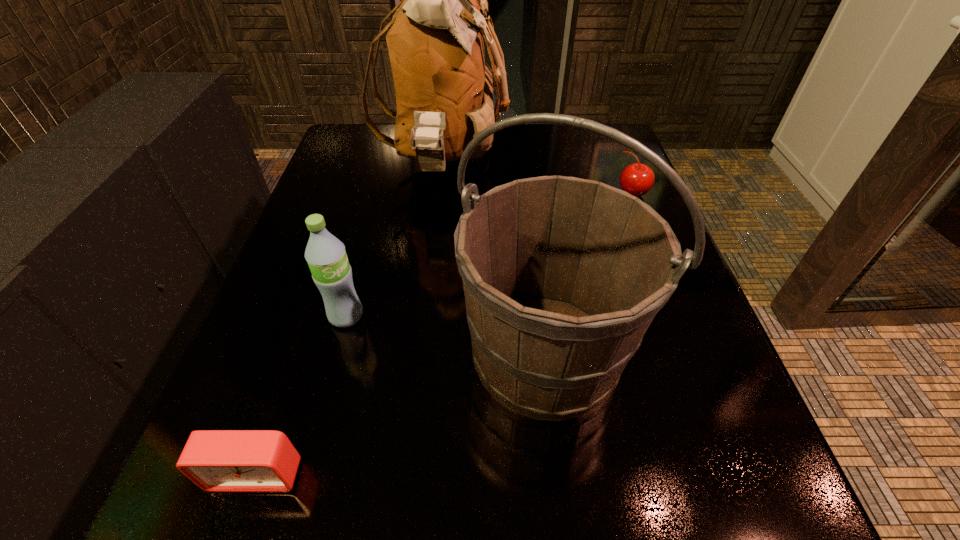
The height and width of the screenshot is (540, 960). I want to click on free space at the left edge of the desktop, so click(308, 210).

Identify the location of free space at the right edge of the desktop. (655, 451).

In the image, there is a desktop. In order to click on vacant space at the far left corner in this screenshot , I will do `click(383, 130)`.

What are the coordinates of `vacant space at the near right corner of the desktop` in the screenshot? It's located at (656, 483).

Where is `vacant area that lies between the alarm clock and the rightmost object`? The width and height of the screenshot is (960, 540). vacant area that lies between the alarm clock and the rightmost object is located at coordinates (444, 333).

Locate an element on the screen. unoccupied position between the bucket and the water bottle is located at coordinates (445, 334).

Find the location of `vacant region between the bucket and the nearest object`. vacant region between the bucket and the nearest object is located at coordinates (401, 413).

Locate an element on the screen. vacant area between the bucket and the water bottle is located at coordinates (445, 334).

Where is `blank region between the nearest object and the rightmost object`? The height and width of the screenshot is (540, 960). blank region between the nearest object and the rightmost object is located at coordinates tap(444, 333).

The width and height of the screenshot is (960, 540). In order to click on free space between the water bottle and the backpack in this screenshot , I will do `click(396, 240)`.